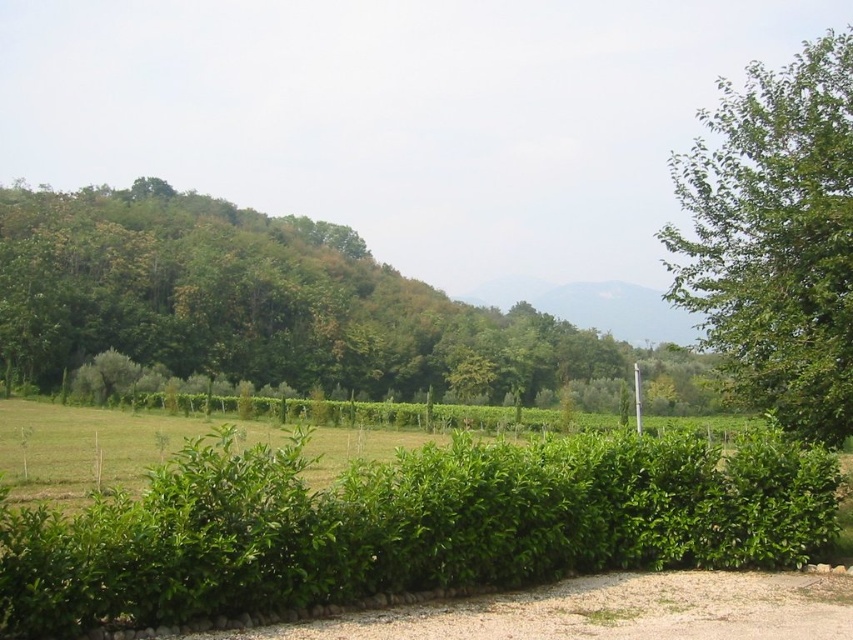
Between green leafy hedge at center and green leafy tree at right, which one appears on the right side from the viewer's perspective?

green leafy tree at right is more to the right.

How far apart are green leafy hedge at center and green leafy tree at right?

green leafy hedge at center and green leafy tree at right are 28.64 meters apart from each other.

Locate an element on the screen. green leafy hedge at center is located at coordinates (408, 524).

The width and height of the screenshot is (853, 640). What are the coordinates of `green leafy hedge at center` in the screenshot? It's located at (408, 524).

Which of these two, green leafy tree at upper left or green leafy tree at right, stands shorter?

With less height is green leafy tree at upper left.

Is green leafy tree at upper left further to the viewer compared to green leafy tree at right?

Yes, green leafy tree at upper left is behind green leafy tree at right.

Between point (376, 266) and point (770, 365), which one is positioned in front?

Point (770, 365) is more forward.

The height and width of the screenshot is (640, 853). I want to click on green leafy tree at upper left, so click(x=270, y=305).

Where is `green leafy hedge at center`? Image resolution: width=853 pixels, height=640 pixels. green leafy hedge at center is located at coordinates (408, 524).

Does green leafy hedge at center appear on the left side of green leafy tree at upper left?

Yes, green leafy hedge at center is to the left of green leafy tree at upper left.

Who is more distant from viewer, (12, 548) or (312, 380)?

Positioned behind is point (312, 380).

Locate an element on the screen. This screenshot has width=853, height=640. green leafy hedge at center is located at coordinates (408, 524).